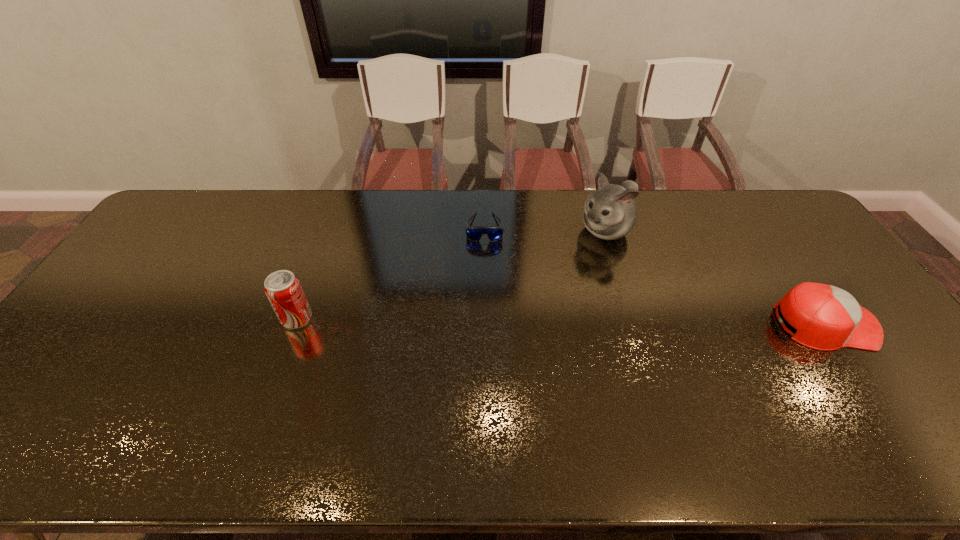
This screenshot has height=540, width=960. In order to click on vacant position in the image that satisfies the following two spatial constraints: 1. on the front side of the rightmost object; 2. on the front-facing side of the leftmost object in this screenshot , I will do `click(295, 323)`.

Where is `vacant position in the image that satisfies the following two spatial constraints: 1. on the front side of the second shortest object; 2. on the front-facing side of the tallest object`? vacant position in the image that satisfies the following two spatial constraints: 1. on the front side of the second shortest object; 2. on the front-facing side of the tallest object is located at coordinates (635, 323).